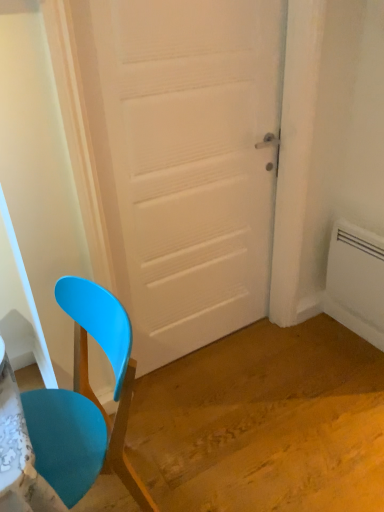
Question: From the image's perspective, is matte plastic chair at left beneath white matte door at center?

Choices:
 (A) yes
 (B) no

Answer: (A)

Question: Does matte plastic chair at left touch white matte door at center?

Choices:
 (A) no
 (B) yes

Answer: (A)

Question: Can you confirm if matte plastic chair at left is smaller than white matte door at center?

Choices:
 (A) no
 (B) yes

Answer: (A)

Question: Is the position of matte plastic chair at left more distant than that of white matte door at center?

Choices:
 (A) yes
 (B) no

Answer: (B)

Question: Is matte plastic chair at left facing towards white matte door at center?

Choices:
 (A) yes
 (B) no

Answer: (B)

Question: From the image's perspective, is matte plastic chair at left above or below white plastic radiator at right?

Choices:
 (A) above
 (B) below

Answer: (B)

Question: Visually, is matte plastic chair at left positioned to the left or to the right of white plastic radiator at right?

Choices:
 (A) left
 (B) right

Answer: (A)

Question: Does point coord(89,294) appear closer or farther from the camera than point coord(365,315)?

Choices:
 (A) closer
 (B) farther

Answer: (A)

Question: Relative to white plastic radiator at right, is matte plastic chair at left in front or behind?

Choices:
 (A) front
 (B) behind

Answer: (A)

Question: Is white matte door at center bigger or smaller than white plastic radiator at right?

Choices:
 (A) small
 (B) big

Answer: (B)

Question: Considering the relative positions of white matte door at center and white plastic radiator at right in the image provided, is white matte door at center to the left or to the right of white plastic radiator at right?

Choices:
 (A) right
 (B) left

Answer: (B)

Question: In terms of width, does white matte door at center look wider or thinner when compared to white plastic radiator at right?

Choices:
 (A) wide
 (B) thin

Answer: (A)

Question: From a real-world perspective, relative to white plastic radiator at right, is white matte door at center vertically above or below?

Choices:
 (A) below
 (B) above

Answer: (B)

Question: Does point (82, 357) appear closer or farther from the camera than point (205, 188)?

Choices:
 (A) farther
 (B) closer

Answer: (B)

Question: From their relative heights in the image, would you say matte plastic chair at left is taller or shorter than white matte door at center?

Choices:
 (A) short
 (B) tall

Answer: (A)